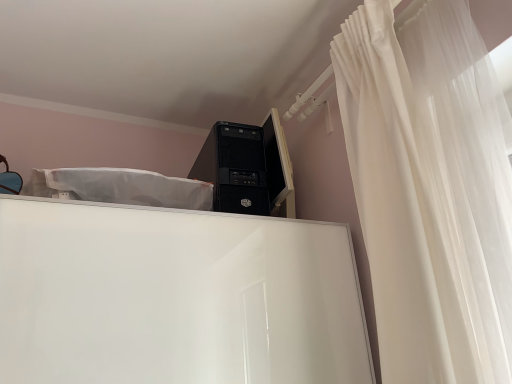
Question: Is matte black monitor at upper right wider than black matte desktop computer at upper center?

Choices:
 (A) yes
 (B) no

Answer: (B)

Question: Is matte black monitor at upper right oriented towards black matte desktop computer at upper center?

Choices:
 (A) yes
 (B) no

Answer: (B)

Question: Considering the relative sizes of matte black monitor at upper right and black matte desktop computer at upper center in the image provided, is matte black monitor at upper right bigger than black matte desktop computer at upper center?

Choices:
 (A) yes
 (B) no

Answer: (B)

Question: Is matte black monitor at upper right behind black matte desktop computer at upper center?

Choices:
 (A) yes
 (B) no

Answer: (A)

Question: Is matte black monitor at upper right touching black matte desktop computer at upper center?

Choices:
 (A) no
 (B) yes

Answer: (B)

Question: Which is correct: matte black monitor at upper right is inside black matte desktop computer at upper center, or outside of it?

Choices:
 (A) inside
 (B) outside

Answer: (B)

Question: In terms of width, does matte black monitor at upper right look wider or thinner when compared to black matte desktop computer at upper center?

Choices:
 (A) wide
 (B) thin

Answer: (B)

Question: From the image's perspective, relative to black matte desktop computer at upper center, is matte black monitor at upper right above or below?

Choices:
 (A) above
 (B) below

Answer: (A)

Question: Looking at the image, does matte black monitor at upper right seem bigger or smaller compared to black matte desktop computer at upper center?

Choices:
 (A) big
 (B) small

Answer: (B)

Question: In the image, is black matte desktop computer at upper center positioned in front of or behind white sheer curtain at upper right?

Choices:
 (A) front
 (B) behind

Answer: (B)

Question: Choose the correct answer: Is black matte desktop computer at upper center inside white sheer curtain at upper right or outside it?

Choices:
 (A) outside
 (B) inside

Answer: (A)

Question: Considering the positions of black matte desktop computer at upper center and white sheer curtain at upper right in the image, is black matte desktop computer at upper center taller or shorter than white sheer curtain at upper right?

Choices:
 (A) tall
 (B) short

Answer: (B)

Question: Looking at their shapes, would you say black matte desktop computer at upper center is wider or thinner than white sheer curtain at upper right?

Choices:
 (A) thin
 (B) wide

Answer: (B)

Question: Choose the correct answer: Is white sheer curtain at upper right inside black matte desktop computer at upper center or outside it?

Choices:
 (A) inside
 (B) outside

Answer: (B)

Question: In terms of width, does white sheer curtain at upper right look wider or thinner when compared to black matte desktop computer at upper center?

Choices:
 (A) thin
 (B) wide

Answer: (A)